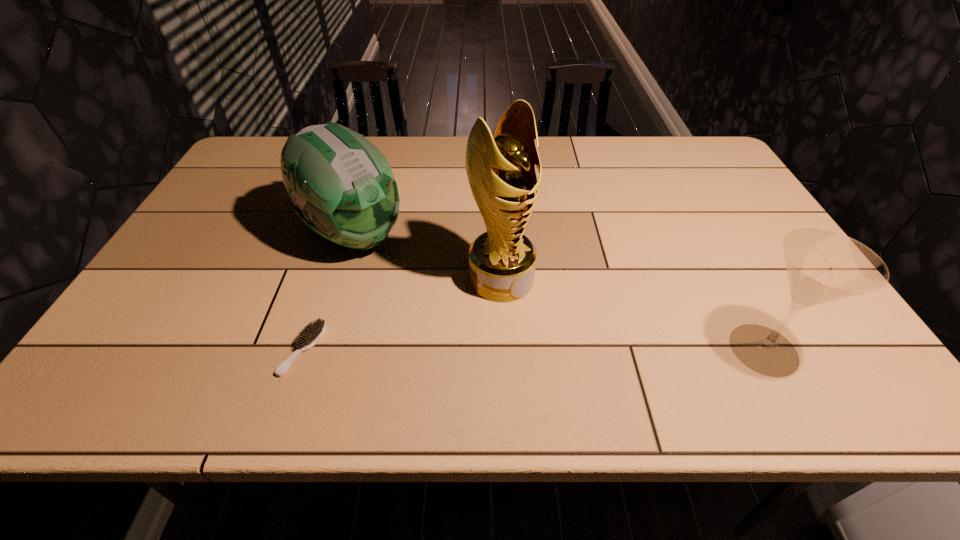
I want to click on free space located 0.220m on the front-facing side of the tallest object, so click(600, 356).

This screenshot has width=960, height=540. Identify the location of vacant space located on the front-facing side of the tallest object. (574, 335).

You are a GUI agent. You are given a task and a screenshot of the screen. Output one action in this format:
    pyautogui.click(x=<x>, y=<y>)
    Task: Click on the scrubbing brush located in the near edge section of the desktop
    This screenshot has height=540, width=960.
    Given the screenshot: What is the action you would take?
    pyautogui.click(x=311, y=334)

Locate an element on the screen. The height and width of the screenshot is (540, 960). flute glass that is at the near edge is located at coordinates (822, 266).

Identify the location of object located at the right edge. Image resolution: width=960 pixels, height=540 pixels. (822, 266).

Identify the location of object situated at the near right corner. 822,266.

In the image, there is a desktop. At what (x,y) coordinates should I click in order to perform the action: click on vacant region at the far edge. Please return your answer as a coordinate pair (x, y). The image size is (960, 540). Looking at the image, I should click on (455, 150).

What are the coordinates of `vacant area at the near edge of the desktop` in the screenshot? It's located at (372, 356).

The width and height of the screenshot is (960, 540). I want to click on vacant region at the left edge, so click(209, 224).

I want to click on vacant space at the right edge, so click(x=736, y=195).